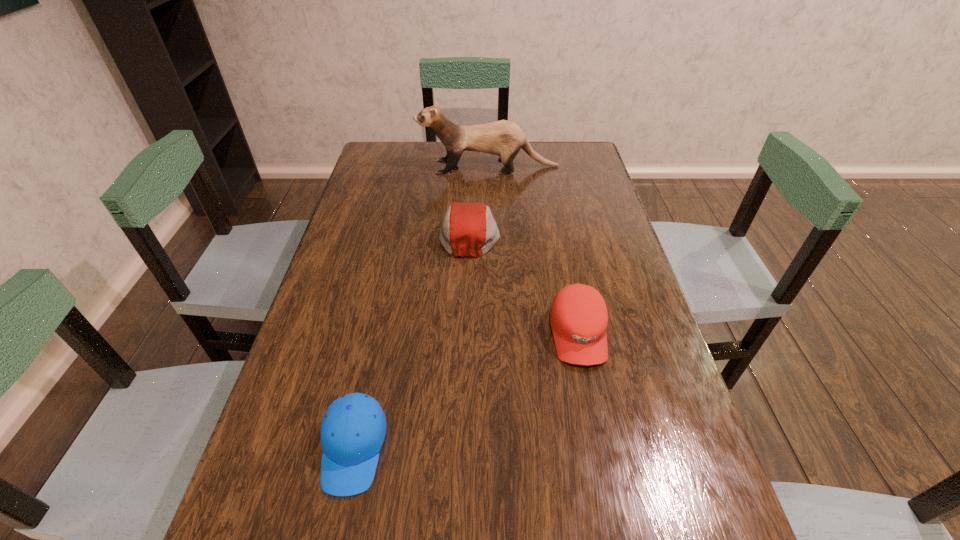
The height and width of the screenshot is (540, 960). Find the location of `the tallest object`. the tallest object is located at coordinates (504, 138).

Identify the location of ferret. Image resolution: width=960 pixels, height=540 pixels. (504, 138).

In order to click on the farthest cap in this screenshot , I will do `click(468, 229)`.

Locate an element on the screen. the second cap from left to right is located at coordinates (468, 229).

Where is `the second nearest object`? This screenshot has height=540, width=960. the second nearest object is located at coordinates pos(578,316).

Locate an element on the screen. The image size is (960, 540). the rightmost cap is located at coordinates (578, 316).

I want to click on the nearest object, so click(353, 430).

Find the location of a particular element. Image resolution: width=960 pixels, height=540 pixels. the nearest cap is located at coordinates (353, 430).

In order to click on vacant space located 0.050m on the face of the ferret in this screenshot , I will do `click(404, 166)`.

You are a GUI agent. You are given a task and a screenshot of the screen. Output one action in this format:
    pyautogui.click(x=<x>, y=<y>)
    Task: Click on the free region located on the face of the ferret
    The image size is (960, 540).
    Given the screenshot: What is the action you would take?
    pyautogui.click(x=368, y=166)